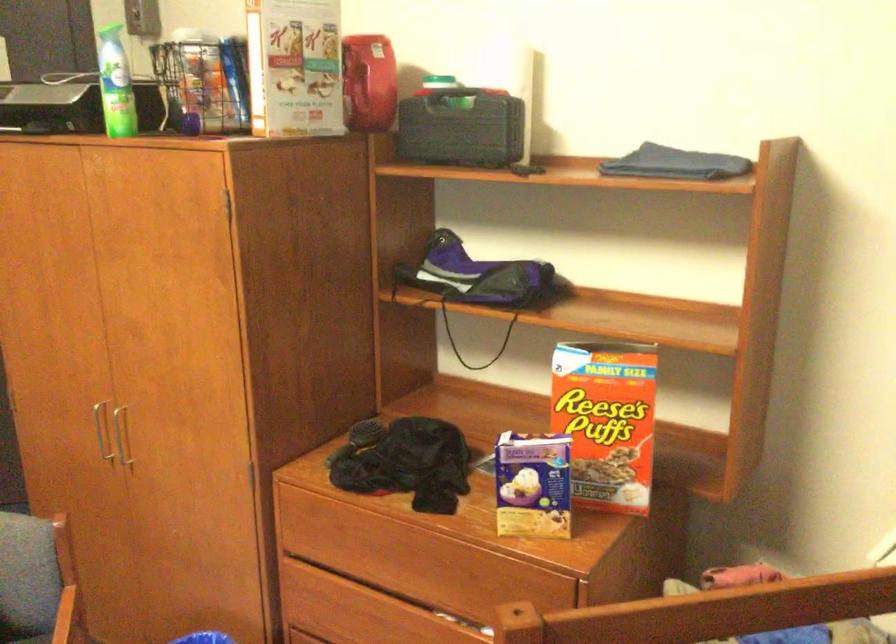
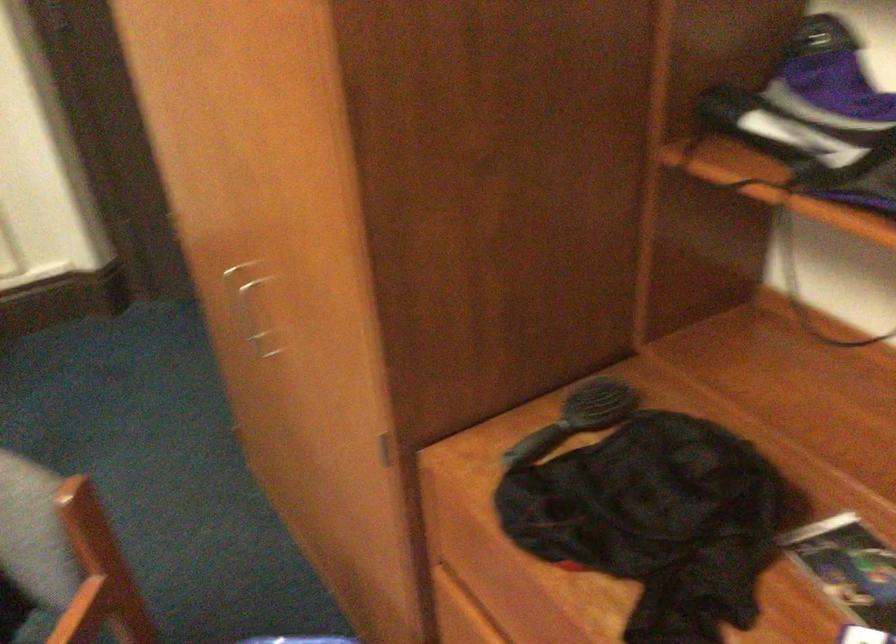
How did the camera likely rotate?

The camera rotated toward left-down.